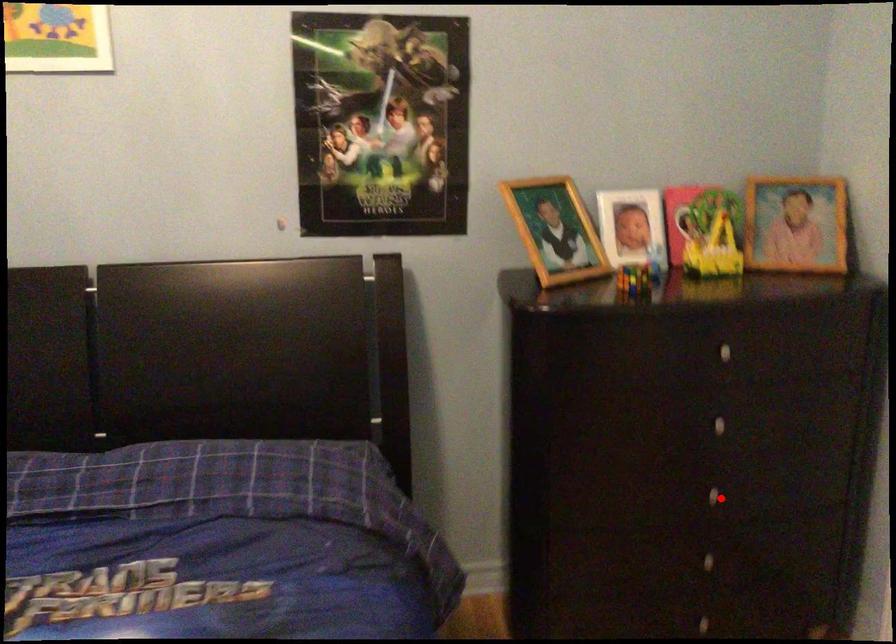
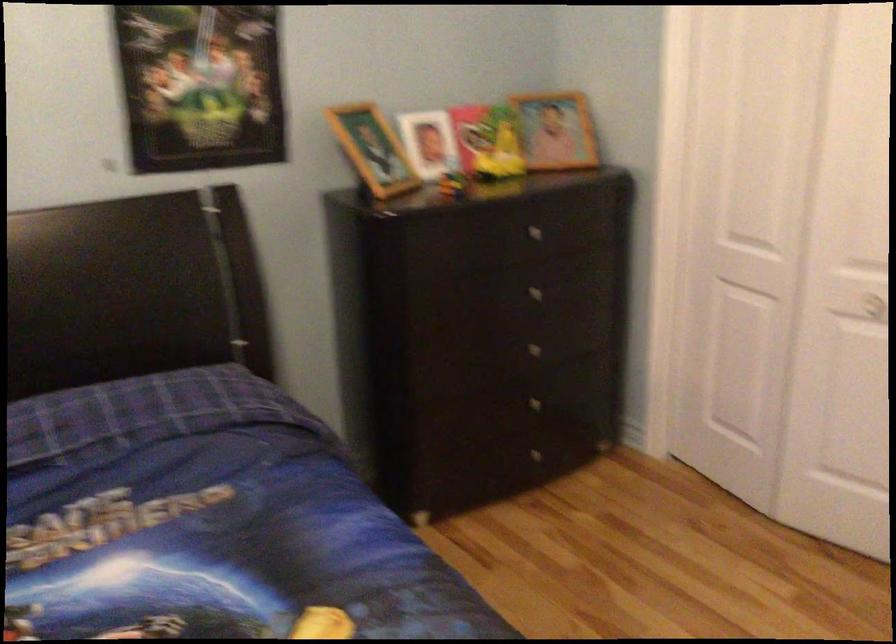
Where in the second image is the point corresponding to the highlighted location from the first image?

(539, 353)